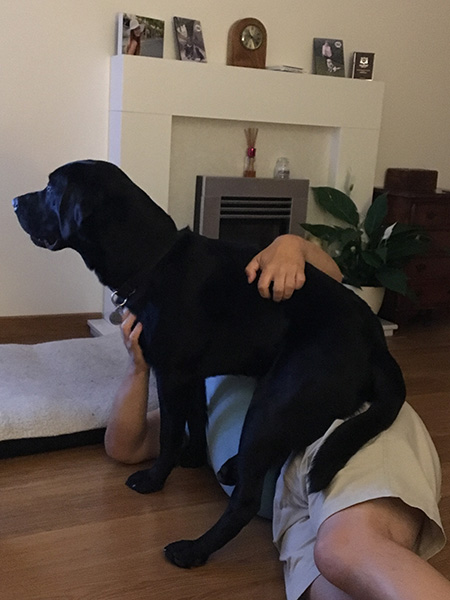
Identify the location of wood floor. (67, 505), (93, 569), (418, 374), (425, 391).